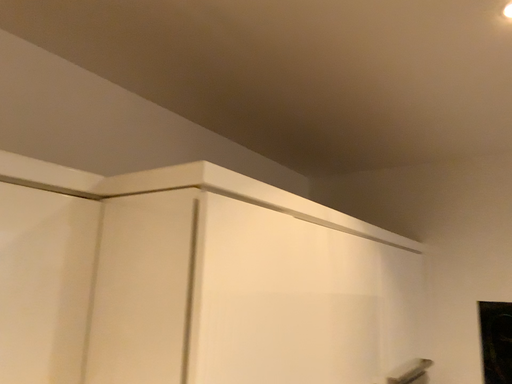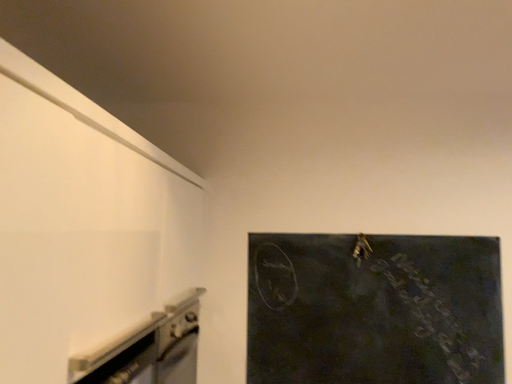
Question: Which way did the camera rotate in the video?

Choices:
 (A) rotated downward
 (B) rotated upward

Answer: (A)